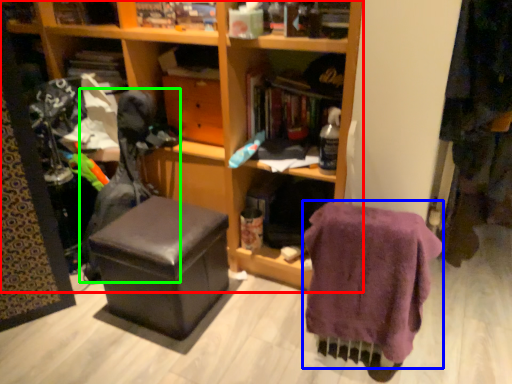
Question: Which object is positioned closest to furniture (highlighted by a red box)? Select from clothing (highlighted by a blue box) and swivel chair (highlighted by a green box).

Choices:
 (A) clothing
 (B) swivel chair

Answer: (B)